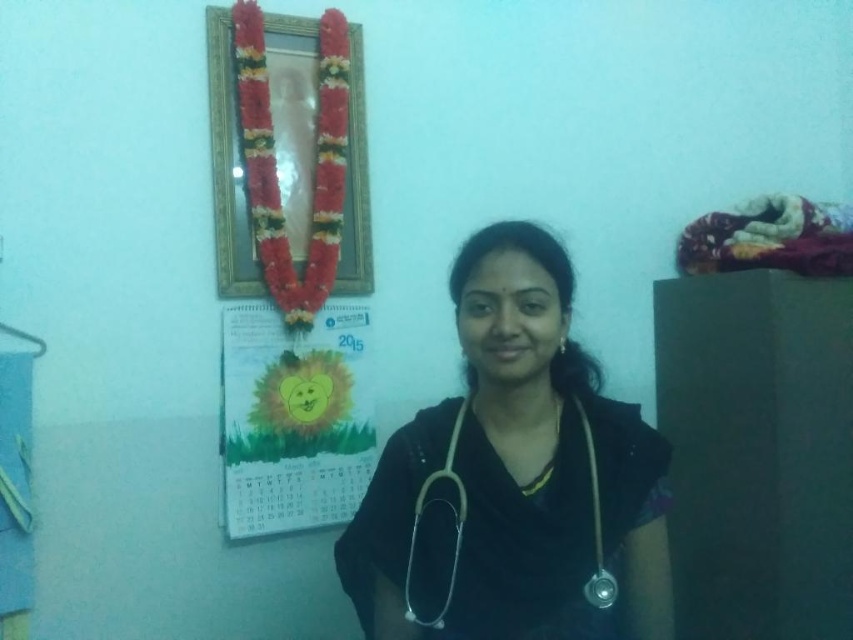
You are a medical student who just entered the room and need to check the calendar below the mirror. Which object between the black fabric stethoscope at center and the gold metallic frame at upper center do you need to move out of the way first?

The gold metallic frame at upper center is taller than the black fabric stethoscope at center, so you need to move the gold metallic frame at upper center first to access the calendar below.

You are a patient in a clinic and see the black fabric stethoscope at center. Where exactly is it located in the room?

The black fabric stethoscope at center is located at point (514, 477) in the room.